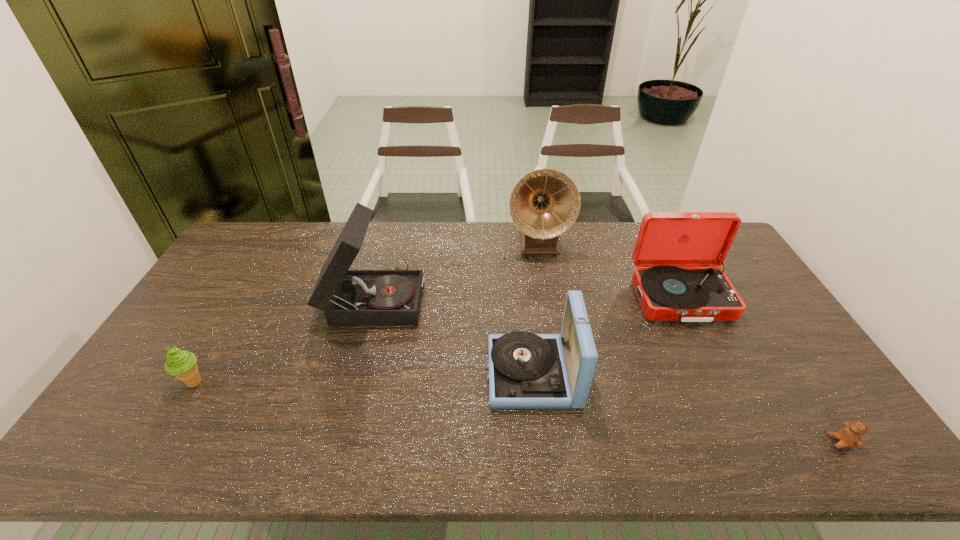
Identify which phonograph record is located as the second nearest to the nearest phonograph record. Please provide its 2D coordinates. Your answer should be formatted as a tuple, i.e. [(x, y)], where the tuple contains the x and y coordinates of a point satisfying the conditions above.

[(666, 241)]

Locate an element on the screen. the second closest phonograph record to the teddy bear is located at coordinates (525, 370).

Image resolution: width=960 pixels, height=540 pixels. What are the coordinates of `free point that satisfies the following two spatial constraints: 1. on the horn of the farthest phonograph record; 2. on the front-facing side of the fifth object from right to left` in the screenshot? It's located at (546, 298).